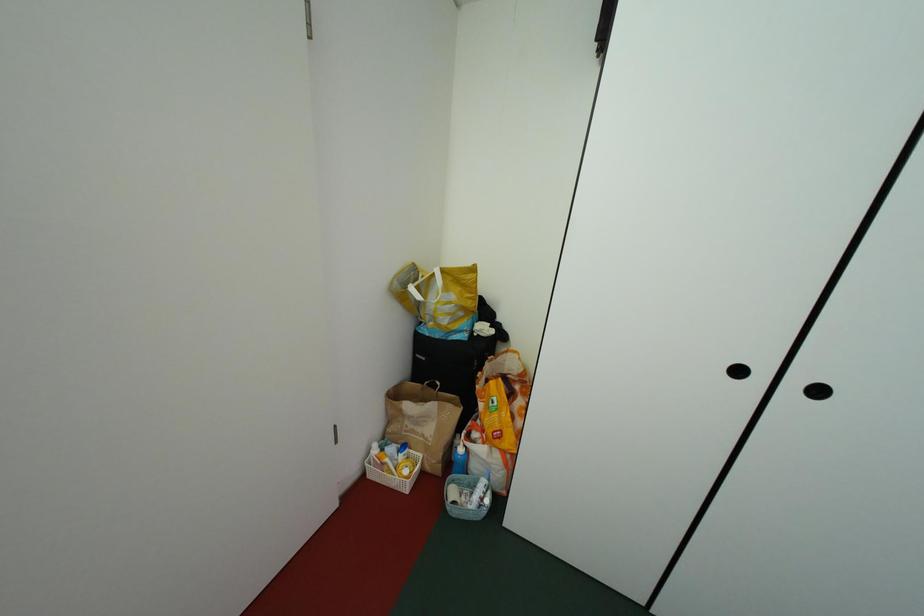
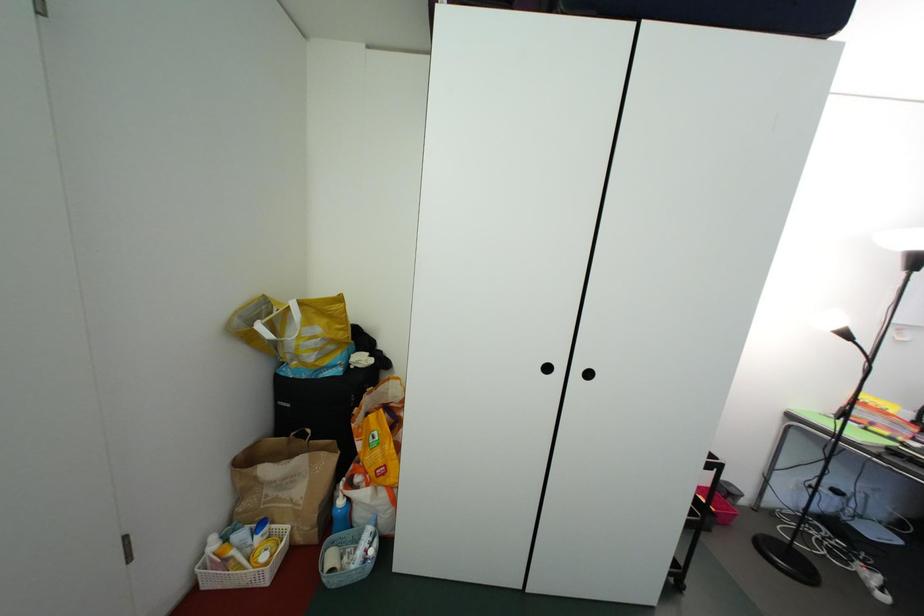
Question: The images are taken continuously from a first-person perspective. In which direction is your viewpoint rotating?

Choices:
 (A) Left
 (B) Right
 (C) Up
 (D) Down

Answer: (B)